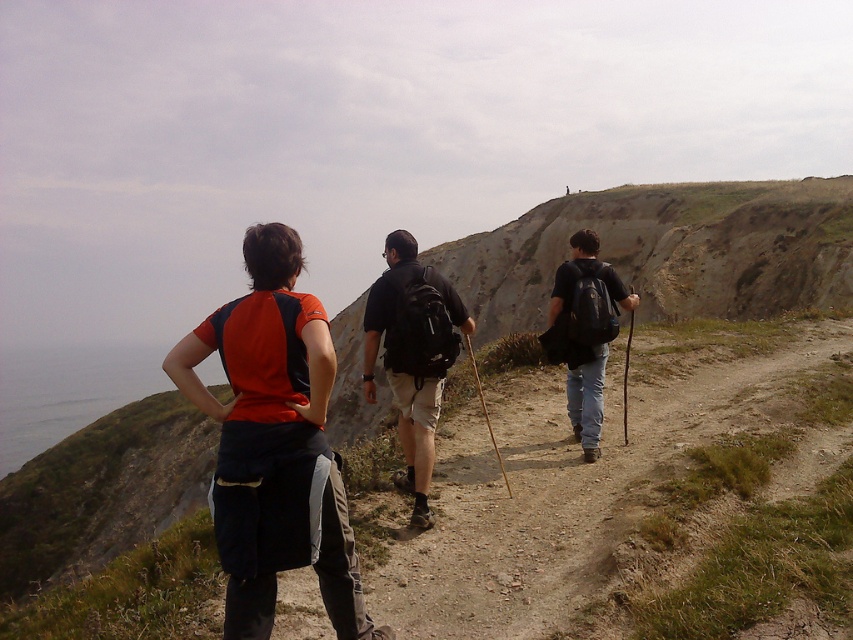
You are standing at the point marked as point (335, 600) on a hiking trail. A fellow hiker is approaching you from the direction of the cliff. If the hiker is moving at a speed of 1.5 meters per second, how many seconds will it take for them to reach you?

The distance between point (335, 600) and the viewer is 3.83 meters. Since the hiker is approaching from the cliff direction, they need to cover this distance. At 1.5 meters per second, the time required is 3.83 divided by 1.5, which equals approximately 2.55 seconds. Therefore, it will take about 2.6 seconds for the hiker to reach you.

You are a drone operator trying to capture aerial footage of the hiking path. You notice two points marked on your map at coordinates point (276,552) and point (399,436). Which point should you prioritize for a closer shot if you want to focus on the terrain nearest to your current position?

Point (276,552) is closer to the camera than point (399,436), so you should prioritize point (276,552) for a closer shot of the terrain nearest to your current position.